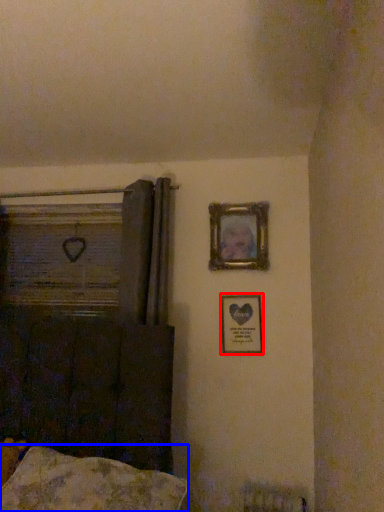
Question: Which of the following is the closest to the observer, picture frame (highlighted by a red box) or pillow (highlighted by a blue box)?

Choices:
 (A) picture frame
 (B) pillow

Answer: (B)